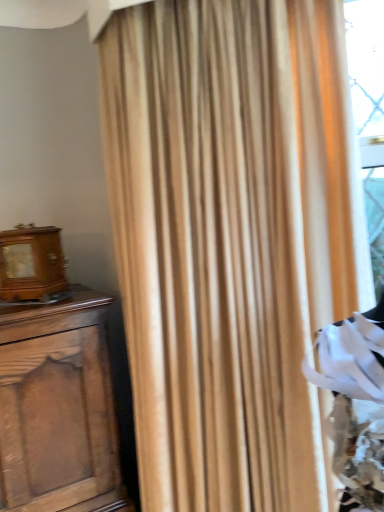
Question: Does matte beige curtain at center have a larger size compared to wooden alarm clock at left?

Choices:
 (A) no
 (B) yes

Answer: (B)

Question: Is matte beige curtain at center taller than wooden alarm clock at left?

Choices:
 (A) yes
 (B) no

Answer: (A)

Question: Could you tell me if matte beige curtain at center is turned towards wooden alarm clock at left?

Choices:
 (A) yes
 (B) no

Answer: (B)

Question: Can you confirm if matte beige curtain at center is thinner than wooden alarm clock at left?

Choices:
 (A) yes
 (B) no

Answer: (B)

Question: Considering the relative sizes of matte beige curtain at center and wooden alarm clock at left in the image provided, is matte beige curtain at center wider than wooden alarm clock at left?

Choices:
 (A) no
 (B) yes

Answer: (B)

Question: Considering the relative positions of matte beige curtain at center and wooden alarm clock at left in the image provided, is matte beige curtain at center behind wooden alarm clock at left?

Choices:
 (A) yes
 (B) no

Answer: (B)

Question: Is wooden alarm clock at left taller than matte beige curtain at center?

Choices:
 (A) no
 (B) yes

Answer: (A)

Question: From a real-world perspective, does wooden alarm clock at left sit lower than matte beige curtain at center?

Choices:
 (A) yes
 (B) no

Answer: (B)

Question: Is wooden alarm clock at left positioned beyond the bounds of matte beige curtain at center?

Choices:
 (A) no
 (B) yes

Answer: (B)

Question: From the image's perspective, does wooden alarm clock at left appear lower than matte beige curtain at center?

Choices:
 (A) no
 (B) yes

Answer: (A)

Question: Is wooden alarm clock at left thinner than matte beige curtain at center?

Choices:
 (A) yes
 (B) no

Answer: (A)

Question: Is wooden alarm clock at left far from matte beige curtain at center?

Choices:
 (A) no
 (B) yes

Answer: (A)

Question: Is matte beige curtain at center taller or shorter than wooden alarm clock at left?

Choices:
 (A) tall
 (B) short

Answer: (A)